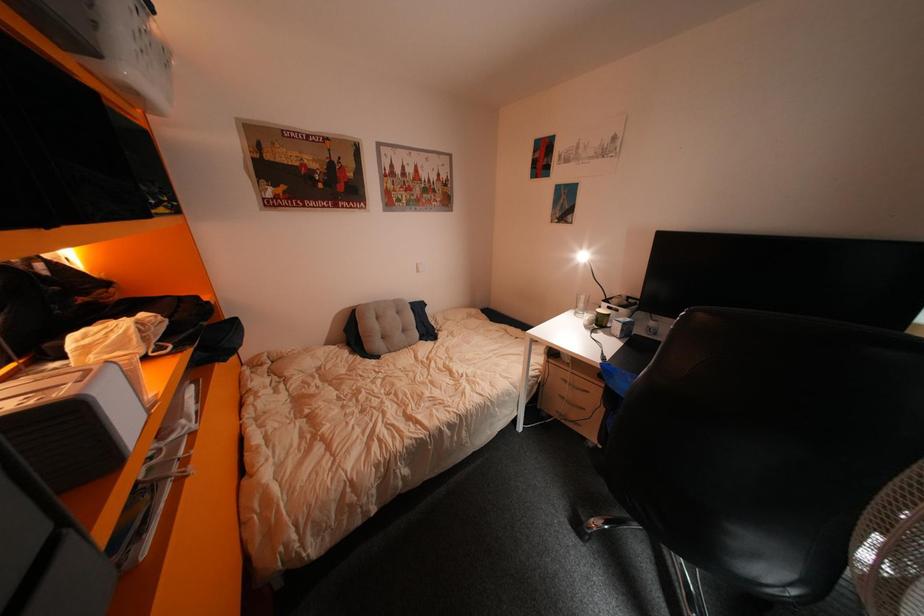
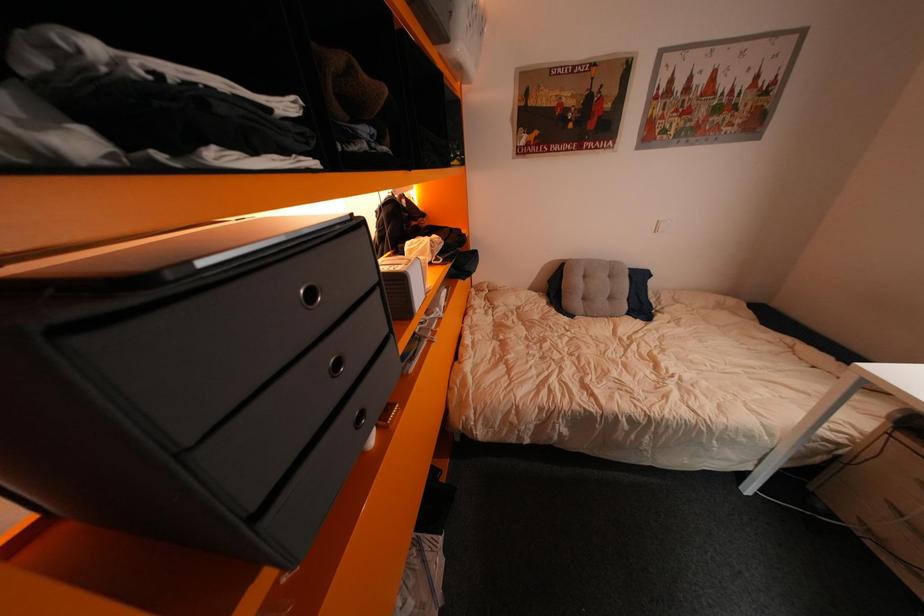
Question: The camera is either moving clockwise (left) or counter-clockwise (right) around the object. The first image is from the beginning of the video and the second image is from the end. Is the camera moving left or right when shooting the video?

Choices:
 (A) Left
 (B) Right

Answer: (B)